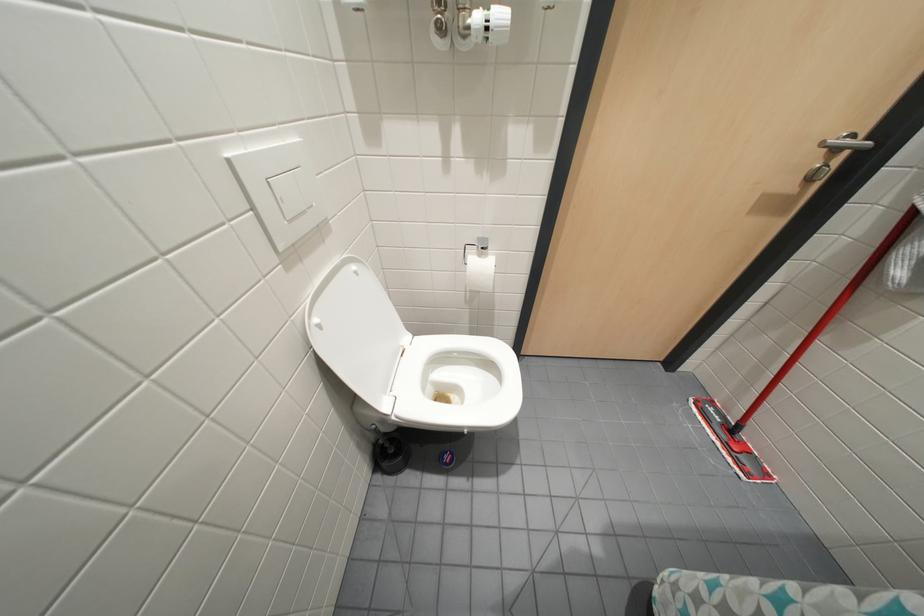
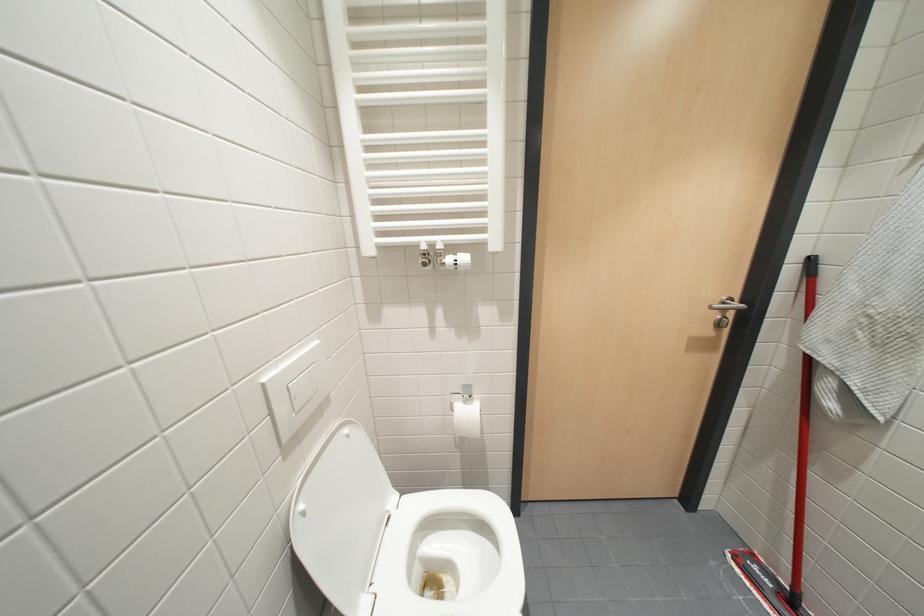
Question: Which direction would the cameraman need to move to produce the second image? Reply with the corresponding letter.

Choices:
 (A) Left
 (B) Right
 (C) Forward
 (D) Backward

Answer: (D)